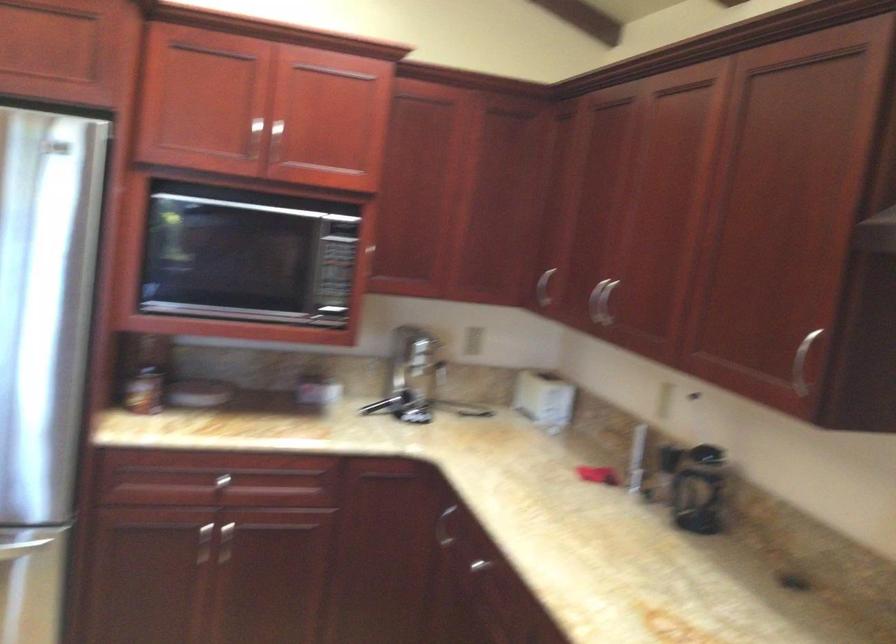
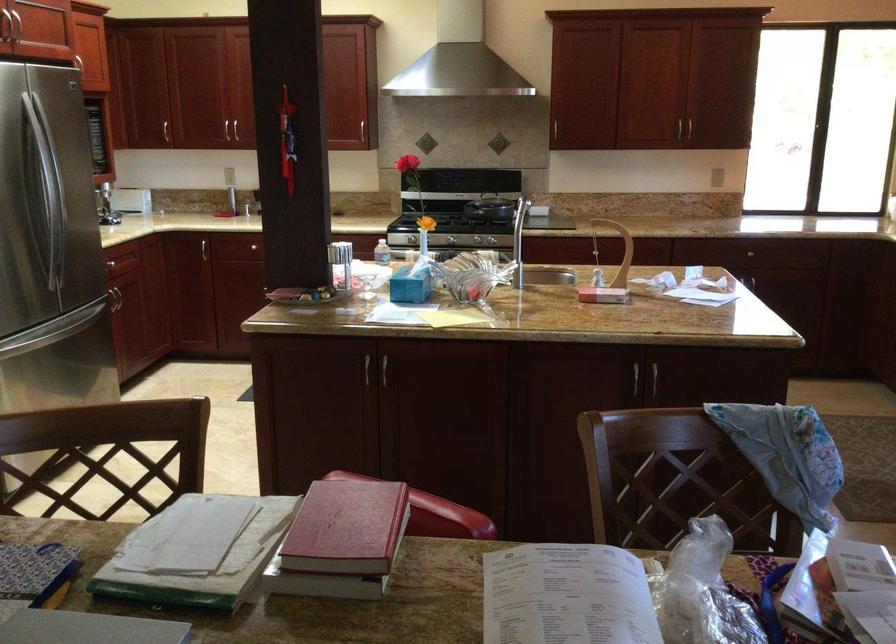
The point at (610,322) is marked in the first image. Where is the corresponding point in the second image?

(165, 131)